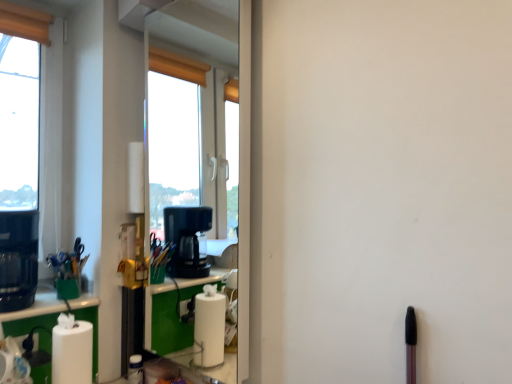
Question: From the image's perspective, is white matte paper towel at lower left over black plastic coffee machine at left?

Choices:
 (A) yes
 (B) no

Answer: (B)

Question: From a real-world perspective, is white matte paper towel at lower left physically above black plastic coffee machine at left?

Choices:
 (A) yes
 (B) no

Answer: (B)

Question: Is white matte paper towel at lower left thinner than black plastic coffee machine at left?

Choices:
 (A) no
 (B) yes

Answer: (B)

Question: From a real-world perspective, is white matte paper towel at lower left positioned under black plastic coffee machine at left based on gravity?

Choices:
 (A) no
 (B) yes

Answer: (B)

Question: Is white matte paper towel at lower left not near black plastic coffee machine at left?

Choices:
 (A) yes
 (B) no

Answer: (B)

Question: Does white matte paper towel at lower left have a larger size compared to black plastic coffee machine at left?

Choices:
 (A) no
 (B) yes

Answer: (A)

Question: Is green matte cup at left oriented towards white matte window at left?

Choices:
 (A) no
 (B) yes

Answer: (A)

Question: From the image's perspective, does green matte cup at left appear higher than white matte window at left?

Choices:
 (A) no
 (B) yes

Answer: (A)

Question: Does green matte cup at left have a lesser width compared to white matte window at left?

Choices:
 (A) no
 (B) yes

Answer: (A)

Question: Considering the relative positions of green matte cup at left and white matte window at left in the image provided, is green matte cup at left to the left of white matte window at left from the viewer's perspective?

Choices:
 (A) no
 (B) yes

Answer: (A)

Question: Is white matte window at left located within green matte cup at left?

Choices:
 (A) yes
 (B) no

Answer: (B)

Question: From a real-world perspective, is green matte cup at left positioned under white matte window at left based on gravity?

Choices:
 (A) no
 (B) yes

Answer: (B)

Question: Are black plastic coffee machine at left and green matte cup at left far apart?

Choices:
 (A) yes
 (B) no

Answer: (B)